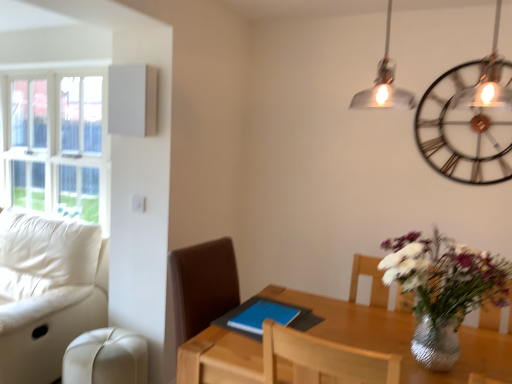
In order to click on empty space that is to the right of blue matte tablet at center in this screenshot , I will do `click(332, 327)`.